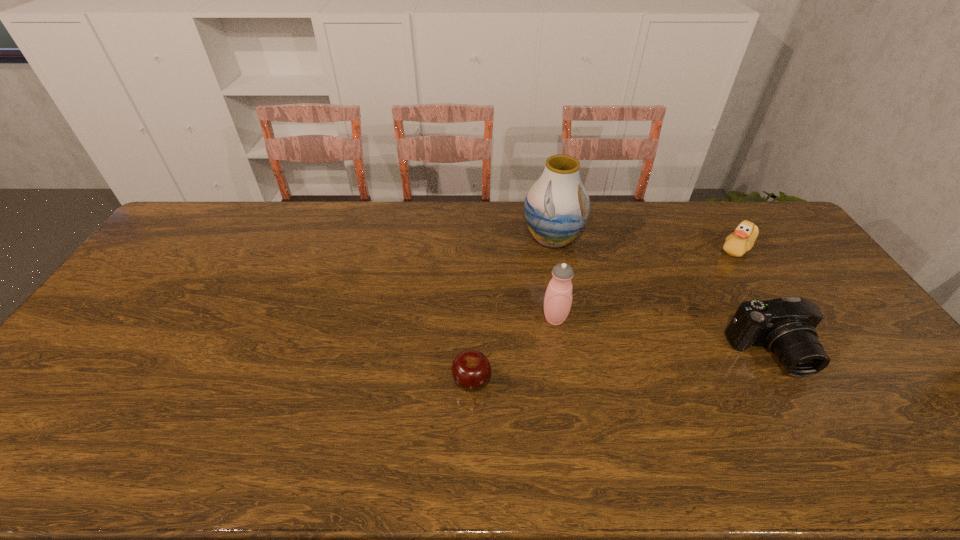
Where is `vase`? The image size is (960, 540). vase is located at coordinates (557, 206).

Locate an element on the screen. thermos bottle is located at coordinates (558, 298).

Image resolution: width=960 pixels, height=540 pixels. Identify the location of the fourth shortest object. (558, 298).

Locate an element on the screen. Image resolution: width=960 pixels, height=540 pixels. camera is located at coordinates (786, 326).

The image size is (960, 540). I want to click on duck, so click(736, 244).

Locate an element on the screen. the shortest object is located at coordinates (471, 369).

Identify the location of the leftmost object. The image size is (960, 540). (471, 369).

I want to click on vacant space located on the front of the tallest object, so click(x=574, y=358).

At what (x,y) coordinates should I click in order to perform the action: click on vacant space located on the left of the thermos bottle. Please return your answer as a coordinate pair (x, y). The width and height of the screenshot is (960, 540). Looking at the image, I should click on (517, 319).

The height and width of the screenshot is (540, 960). I want to click on free point located on the lens of the camera, so click(x=839, y=474).